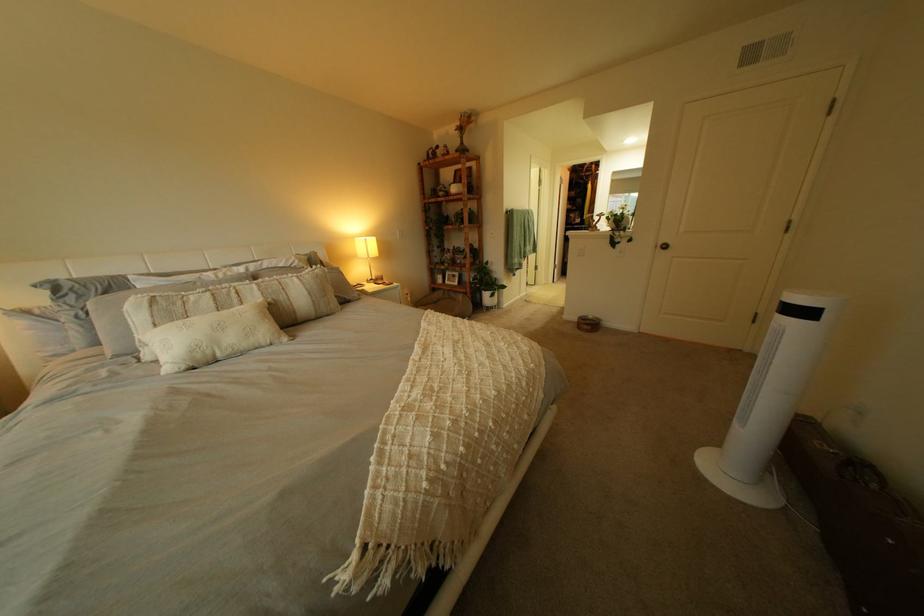
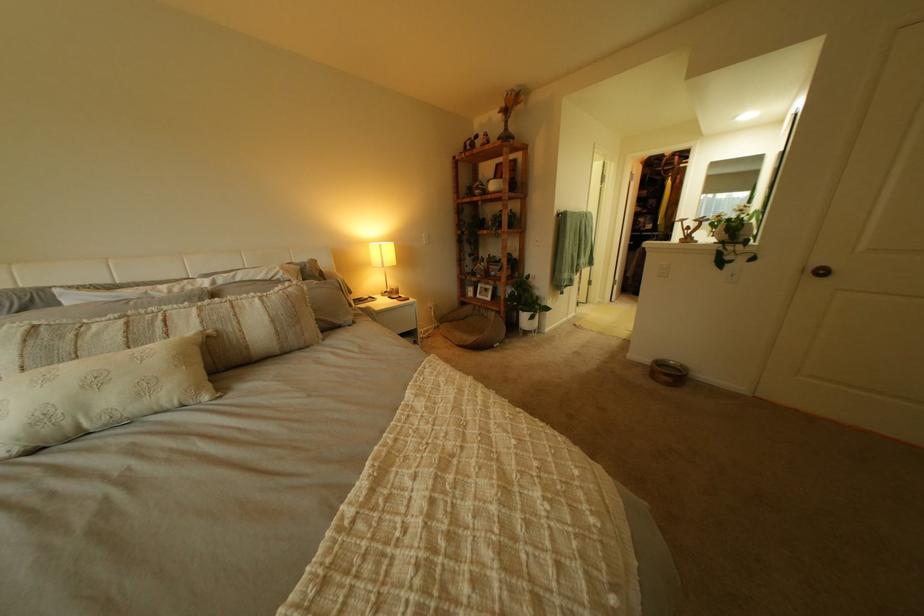
Question: The camera is either moving clockwise (left) or counter-clockwise (right) around the object. The first image is from the beginning of the video and the second image is from the end. Is the camera moving left or right when shooting the video?

Choices:
 (A) Left
 (B) Right

Answer: (B)